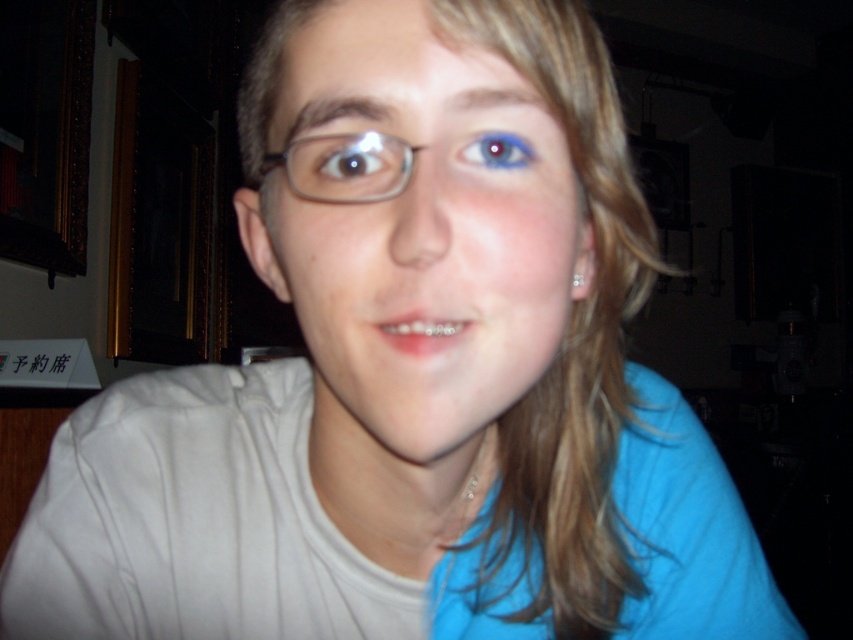
Does clear plastic glasses at center have a larger size compared to blue matte eye at center?

Correct, clear plastic glasses at center is larger in size than blue matte eye at center.

Does clear plastic glasses at center have a greater width compared to blue matte eye at center?

Correct, the width of clear plastic glasses at center exceeds that of blue matte eye at center.

From the picture: Who is more distant from viewer, (379, 160) or (376, 186)?

The point (379, 160) is behind.

This screenshot has height=640, width=853. What are the coordinates of `clear plastic glasses at center` in the screenshot? It's located at (345, 166).

Describe the element at coordinates (416, 237) in the screenshot. I see `matte plastic face at center` at that location.

Is matte plastic face at center wider than blue matte eye at upper center?

Yes.

Who is more forward, (457, 256) or (498, 163)?

Positioned in front is point (457, 256).

I want to click on matte plastic face at center, so click(x=416, y=237).

Does matte plastic face at center have a greater height compared to blue matte eye at center?

Yes, matte plastic face at center is taller than blue matte eye at center.

Which is above, matte plastic face at center or blue matte eye at center?

blue matte eye at center

Which is behind, point (421, 132) or point (367, 182)?

Positioned behind is point (367, 182).

The height and width of the screenshot is (640, 853). I want to click on matte plastic face at center, so click(416, 237).